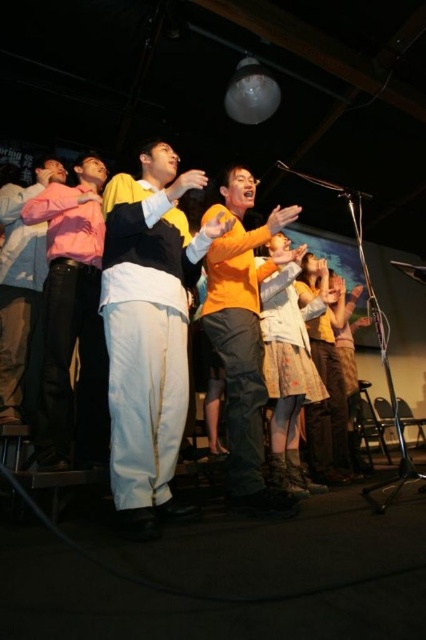
Can you confirm if pink matte shirt at left is wider than orange matte shirt at center?

Yes, pink matte shirt at left is wider than orange matte shirt at center.

Can you confirm if pink matte shirt at left is shorter than orange matte shirt at center?

No.

This screenshot has width=426, height=640. Describe the element at coordinates (71, 320) in the screenshot. I see `pink matte shirt at left` at that location.

The image size is (426, 640). What are the coordinates of `pink matte shirt at left` in the screenshot? It's located at (71, 320).

Between point (169, 472) and point (29, 220), which one is positioned in front?

Point (169, 472) is more forward.

In the scene shown: Is white cotton pants at center thinner than pink matte shirt at left?

In fact, white cotton pants at center might be wider than pink matte shirt at left.

Where is `white cotton pants at center`? The height and width of the screenshot is (640, 426). white cotton pants at center is located at coordinates (149, 330).

I want to click on white cotton pants at center, so click(x=149, y=330).

Between white cotton pants at center and orange matte shirt at center, which one has less height?

Standing shorter between the two is orange matte shirt at center.

Who is positioned more to the left, white cotton pants at center or orange matte shirt at center?

white cotton pants at center

Does point (160, 264) come behind point (262, 472)?

No, (160, 264) is closer to viewer.

Locate an element on the screen. white cotton pants at center is located at coordinates (149, 330).